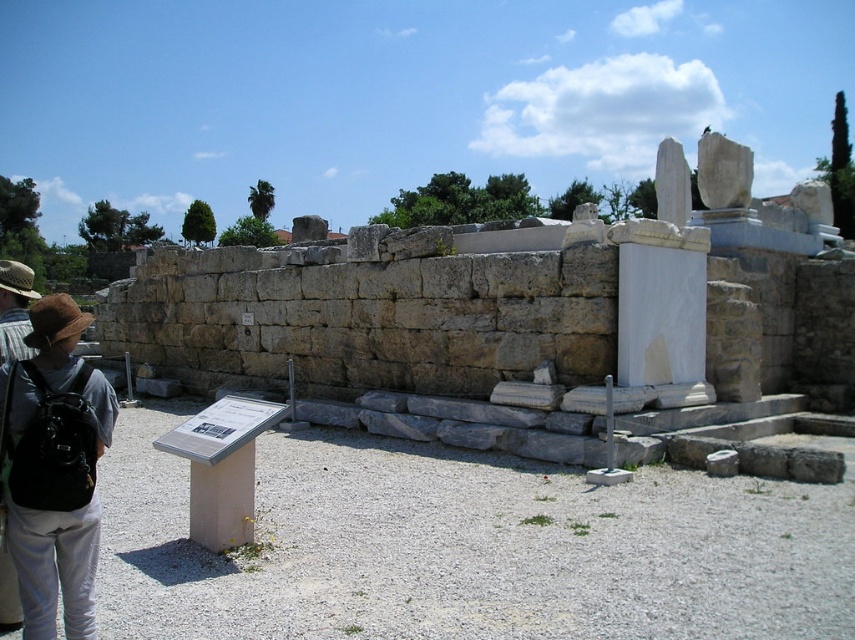
Which is above, stone wall at center or brown fabric backpack at lower left?

stone wall at center is higher up.

Between point (258, 387) and point (33, 321), which one is positioned in front?

Point (33, 321) is in front.

Does point (677, 301) come farther from viewer compared to point (12, 488)?

Yes, point (677, 301) is farther from viewer.

This screenshot has width=855, height=640. Identify the location of stone wall at center. (516, 317).